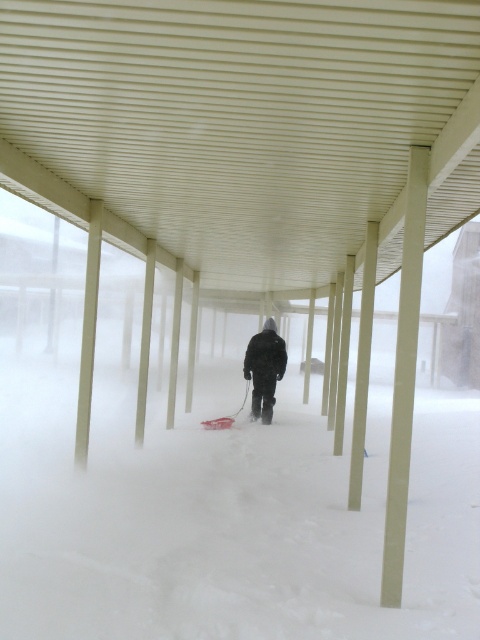
Does white corrugated metal canopy at center appear over white fluffy snow at center?

Yes.

Is point (308, 64) positioned behind point (195, 410)?

No, (308, 64) is in front of (195, 410).

Is point (47, 108) behind point (276, 621)?

That is True.

I want to click on white corrugated metal canopy at center, so point(250,122).

Which is behind, point (225, 264) or point (268, 360)?

The point (225, 264) is more distant.

Which of these two, white corrugated metal canopy at center or dark matte jacket at center, stands shorter?

white corrugated metal canopy at center is shorter.

Is point (28, 19) positioned after point (264, 419)?

No, it is in front of (264, 419).

I want to click on white corrugated metal canopy at center, so click(250, 122).

Between point (356, 627) and point (261, 355), which one is positioned behind?

The point (261, 355) is more distant.

Between white fluffy snow at center and dark matte jacket at center, which one is positioned lower?

white fluffy snow at center is below.

Does point (292, 436) lie behind point (266, 336)?

No, (292, 436) is closer to viewer.

Identify the location of white fluffy snow at center. Image resolution: width=480 pixels, height=640 pixels. (242, 529).